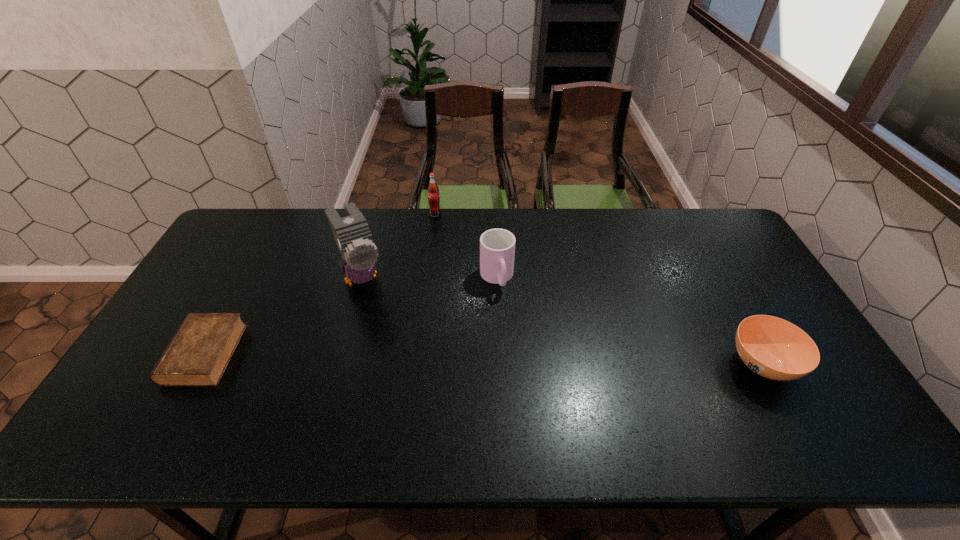
Identify the location of vacant point located between the cup and the farthest object. Image resolution: width=960 pixels, height=540 pixels. (466, 246).

The height and width of the screenshot is (540, 960). Find the location of `empty space between the farthest object and the bird`. empty space between the farthest object and the bird is located at coordinates (398, 246).

At what (x,y) coordinates should I click in order to perform the action: click on free area in between the second object from left to right and the soda bottle. Please return your answer as a coordinate pair (x, y). Looking at the image, I should click on (398, 246).

What are the coordinates of `object that is the closest one to the farthest object` in the screenshot? It's located at (353, 237).

Locate which object is the fourth closest to the second object from right to left. Please provide its 2D coordinates. Your answer should be formatted as a tuple, i.e. [(x, y)], where the tuple contains the x and y coordinates of a point satisfying the conditions above.

[(198, 354)]